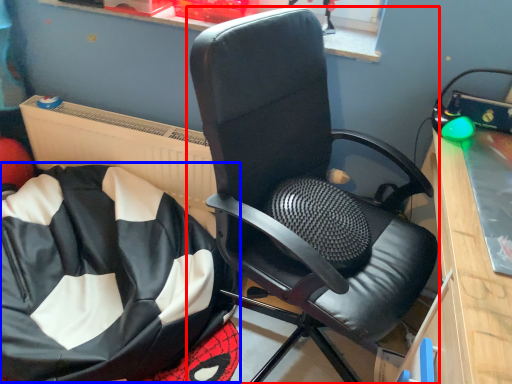
Question: Among these objects, which one is nearest to the camera, chair (highlighted by a red box) or bean bag chair (highlighted by a blue box)?

Choices:
 (A) chair
 (B) bean bag chair

Answer: (A)